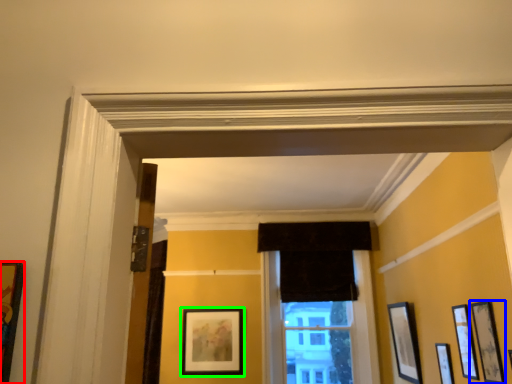
Question: Considering the real-world distances, which object is closest to picture frame (highlighted by a red box)? picture frame (highlighted by a blue box) or picture frame (highlighted by a green box).

Choices:
 (A) picture frame
 (B) picture frame

Answer: (A)